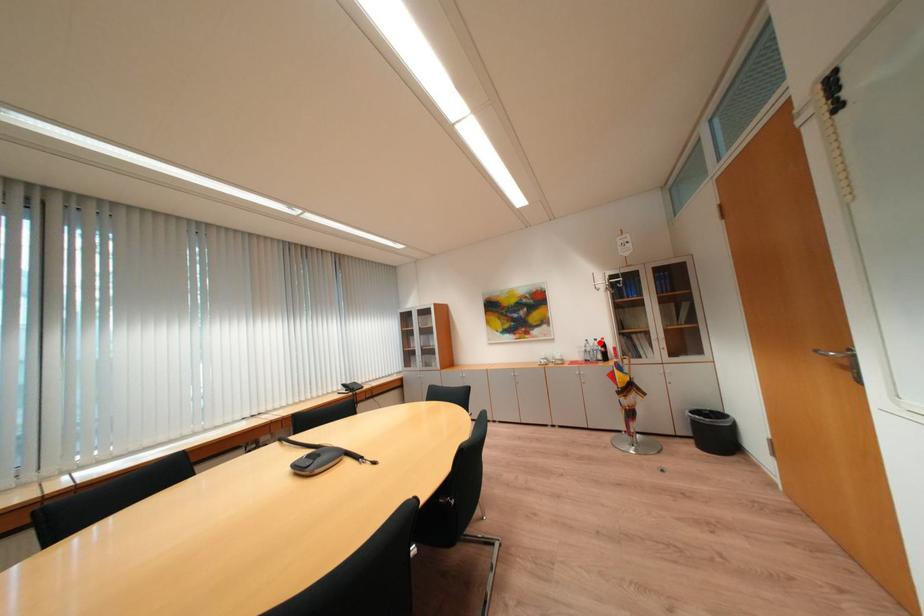
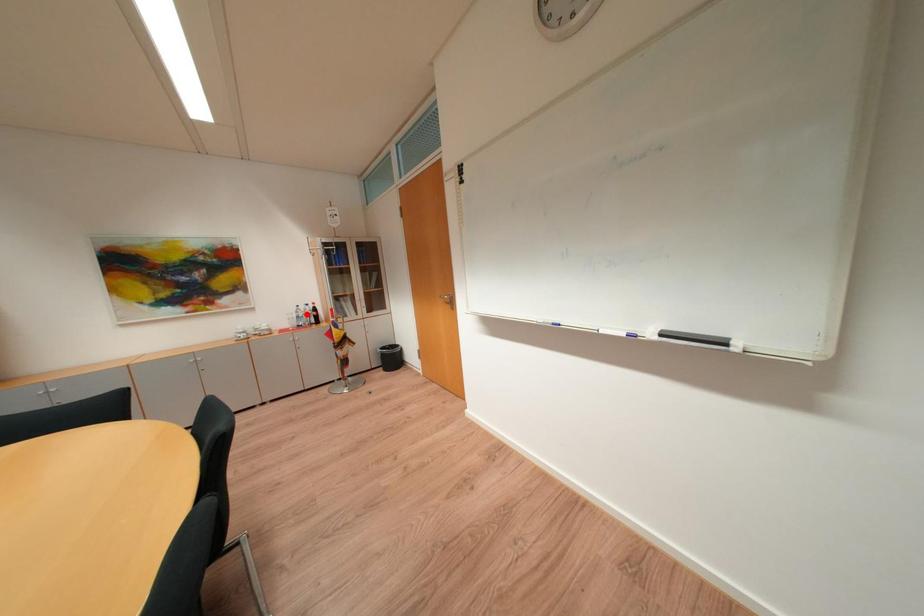
I am providing you with two images of the same scene from different viewpoints. A red point is marked on the first image and another point is marked on the second image. Does the point marked in image1 correspond to the same location as the one in image2?

No